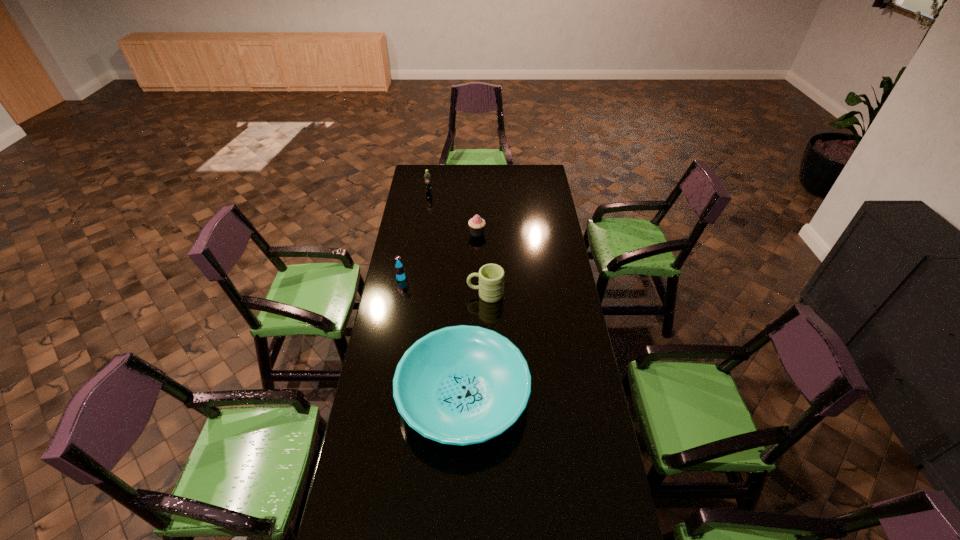
Image resolution: width=960 pixels, height=540 pixels. Find the location of `empty location between the cupcake and the nearest object`. empty location between the cupcake and the nearest object is located at coordinates (470, 314).

At what (x,y) coordinates should I click in order to perform the action: click on free space between the mug and the cupcake. Please return your answer as a coordinate pair (x, y). The height and width of the screenshot is (540, 960). Looking at the image, I should click on (481, 264).

Find the location of a particular element. The height and width of the screenshot is (540, 960). vacant area between the farthest object and the dish is located at coordinates (446, 294).

Where is `free space between the third farthest object and the mug`? free space between the third farthest object and the mug is located at coordinates (444, 286).

This screenshot has height=540, width=960. I want to click on free space between the nearest object and the second farthest object, so click(470, 314).

You are a GUI agent. You are given a task and a screenshot of the screen. Output one action in this format:
    pyautogui.click(x=<x>, y=<y>)
    Task: Click on the empty location between the dish and the cupcake
    
    Given the screenshot: What is the action you would take?
    pyautogui.click(x=470, y=314)

Identify which object is located as the fourth nearest to the farthest object. Please provide its 2D coordinates. Your answer should be formatted as a tuple, i.e. [(x, y)], where the tuple contains the x and y coordinates of a point satisfying the conditions above.

[(460, 385)]

Where is `object identified as the third closest to the nearest object`? This screenshot has height=540, width=960. object identified as the third closest to the nearest object is located at coordinates (476, 224).

I want to click on vacant space that satisfies the following two spatial constraints: 1. on the back side of the fourth nearest object; 2. on the right side of the dish, so click(468, 233).

This screenshot has width=960, height=540. I want to click on free space that satisfies the following two spatial constraints: 1. on the front label of the farthest object; 2. on the right side of the nearest object, so click(398, 395).